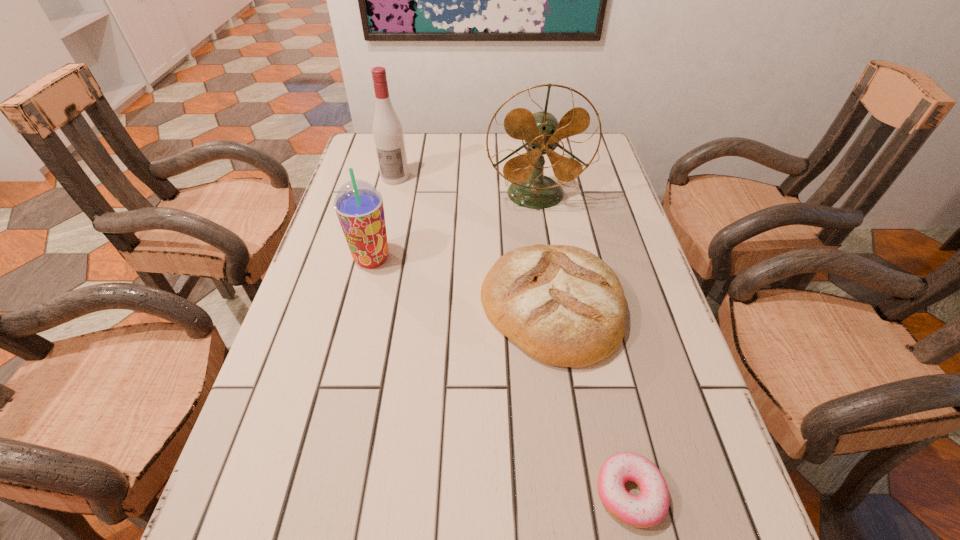
This screenshot has width=960, height=540. Find the location of `vacant region at the right edge`. vacant region at the right edge is located at coordinates (603, 230).

You are a GUI agent. You are given a task and a screenshot of the screen. Output one action in this format:
    pyautogui.click(x=<x>, y=<y>)
    Task: Click on the vacant point at the far left corner
    The image size is (960, 540).
    Given the screenshot: What is the action you would take?
    pyautogui.click(x=361, y=149)

I want to click on free space at the far right corner, so 593,160.

Where is `vacant space that is in between the third tallest object and the fourth tallest object`? The width and height of the screenshot is (960, 540). vacant space that is in between the third tallest object and the fourth tallest object is located at coordinates (462, 283).

This screenshot has width=960, height=540. Identify the location of vacant area between the shortest object and the third shortest object. (500, 376).

Locate an element on the screen. The height and width of the screenshot is (540, 960). free space between the smoothie and the fan is located at coordinates (454, 227).

Where is `empty space between the smoothie and the fan`? empty space between the smoothie and the fan is located at coordinates (454, 227).

Locate an element on the screen. vacant area between the fan and the alcohol is located at coordinates (466, 186).

Identify the location of object that stands as the closest to the shortest object. (564, 306).

Select which object is the closest to the shortest object. Please provide its 2D coordinates. Your answer should be formatted as a tuple, i.e. [(x, y)], where the tuple contains the x and y coordinates of a point satisfying the conditions above.

[(564, 306)]